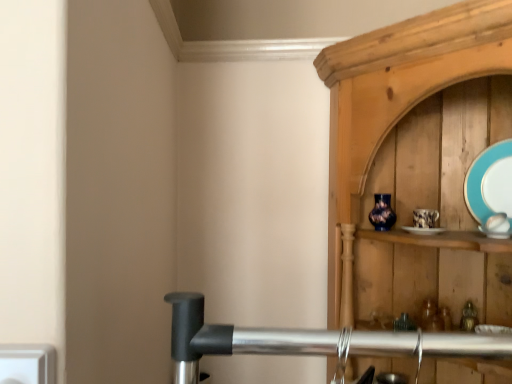
The width and height of the screenshot is (512, 384). I want to click on white plastic electric outlet at lower left, so click(27, 364).

Image resolution: width=512 pixels, height=384 pixels. What do you see at coordinates (27, 364) in the screenshot?
I see `white plastic electric outlet at lower left` at bounding box center [27, 364].

Describe the element at coordinates (490, 190) in the screenshot. I see `teal glossy plate at upper right` at that location.

In order to click on teal glossy plate at upper right in this screenshot , I will do `click(490, 190)`.

Measure the distance between teal glossy plate at upper right and camera.

They are 3.37 feet apart.

This screenshot has height=384, width=512. Identify the location of white plastic electric outlet at lower left. (27, 364).

In the scene shown: Between teal glossy plate at upper right and white plastic electric outlet at lower left, which one appears on the right side from the viewer's perspective?

Positioned to the right is teal glossy plate at upper right.

Consider the image. Considering their positions, is teal glossy plate at upper right located in front of or behind white plastic electric outlet at lower left?

Visually, teal glossy plate at upper right is located behind white plastic electric outlet at lower left.

Considering the positions of points (502, 158) and (3, 360), is point (502, 158) farther from camera compared to point (3, 360)?

Yes, point (502, 158) is behind point (3, 360).

From the image's perspective, is teal glossy plate at upper right positioned above or below white plastic electric outlet at lower left?

teal glossy plate at upper right is situated higher than white plastic electric outlet at lower left in the image.

From a real-world perspective, is teal glossy plate at upper right under white plastic electric outlet at lower left?

No, from a real-world perspective, teal glossy plate at upper right is not beneath white plastic electric outlet at lower left.

Can you confirm if teal glossy plate at upper right is wider than white plastic electric outlet at lower left?

In fact, teal glossy plate at upper right might be narrower than white plastic electric outlet at lower left.

Does teal glossy plate at upper right have a greater height compared to white plastic electric outlet at lower left?

Correct, teal glossy plate at upper right is much taller as white plastic electric outlet at lower left.

Does teal glossy plate at upper right have a smaller size compared to white plastic electric outlet at lower left?

Actually, teal glossy plate at upper right might be larger than white plastic electric outlet at lower left.

Choose the correct answer: Is teal glossy plate at upper right inside white plastic electric outlet at lower left or outside it?

teal glossy plate at upper right is located beyond the bounds of white plastic electric outlet at lower left.

Is teal glossy plate at upper right next to white plastic electric outlet at lower left?

No, teal glossy plate at upper right is not beside white plastic electric outlet at lower left.

Is teal glossy plate at upper right positioned with its back to white plastic electric outlet at lower left?

teal glossy plate at upper right does not have its back to white plastic electric outlet at lower left.

How different are the orientations of teal glossy plate at upper right and white plastic electric outlet at lower left in degrees?

51.4 degrees separate the facing orientations of teal glossy plate at upper right and white plastic electric outlet at lower left.

Identify the location of electric outlet below the teal glossy plate at upper right (from a real-world perspective). This screenshot has height=384, width=512. (27, 364).

Is white plastic electric outlet at lower left at the right side of teal glossy plate at upper right?

Incorrect, white plastic electric outlet at lower left is not on the right side of teal glossy plate at upper right.

Is white plastic electric outlet at lower left further to the viewer compared to teal glossy plate at upper right?

No, it is not.

Does point (21, 364) appear closer or farther from the camera than point (473, 166)?

Point (21, 364) appears to be closer to the viewer than point (473, 166).

From the image's perspective, which one is positioned lower, white plastic electric outlet at lower left or teal glossy plate at upper right?

white plastic electric outlet at lower left, from the image's perspective.

From a real-world perspective, relative to teal glossy plate at upper right, is white plastic electric outlet at lower left vertically above or below?

From a real-world perspective, white plastic electric outlet at lower left is physically below teal glossy plate at upper right.

Is white plastic electric outlet at lower left thinner than teal glossy plate at upper right?

In fact, white plastic electric outlet at lower left might be wider than teal glossy plate at upper right.

From the picture: Does white plastic electric outlet at lower left have a greater height compared to teal glossy plate at upper right?

In fact, white plastic electric outlet at lower left may be shorter than teal glossy plate at upper right.

Is white plastic electric outlet at lower left smaller than teal glossy plate at upper right?

Yes, white plastic electric outlet at lower left is smaller than teal glossy plate at upper right.

Would you say white plastic electric outlet at lower left is outside teal glossy plate at upper right?

That's correct, white plastic electric outlet at lower left is outside of teal glossy plate at upper right.

Based on the photo, are white plastic electric outlet at lower left and teal glossy plate at upper right far apart?

white plastic electric outlet at lower left is positioned a significant distance from teal glossy plate at upper right.

In the scene shown: Is white plastic electric outlet at lower left oriented towards teal glossy plate at upper right?

No, white plastic electric outlet at lower left is not facing towards teal glossy plate at upper right.

Locate an element on the screen. This screenshot has height=384, width=512. electric outlet that appears on the left of teal glossy plate at upper right is located at coordinates (27, 364).

The image size is (512, 384). I want to click on electric outlet below the teal glossy plate at upper right (from a real-world perspective), so 27,364.

The image size is (512, 384). What are the coordinates of `electric outlet in front of the teal glossy plate at upper right` in the screenshot? It's located at (27, 364).